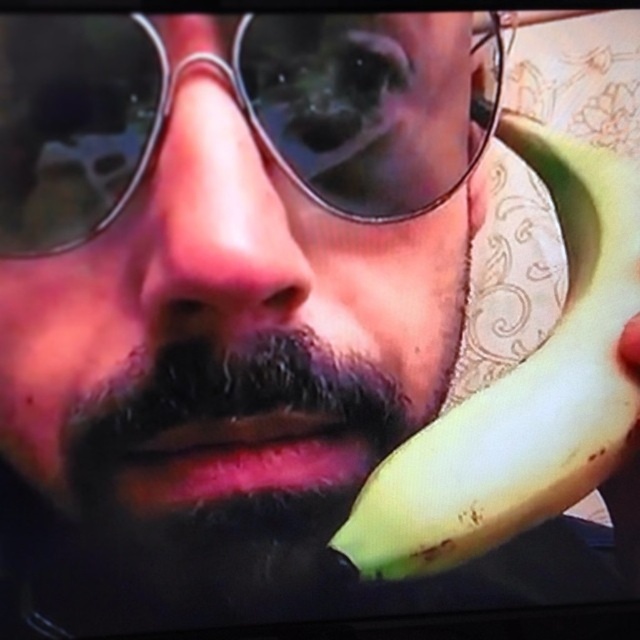
Question: Is matte black sunglasses at center closer to camera compared to metallic round sunglasses at center?

Choices:
 (A) yes
 (B) no

Answer: (B)

Question: Which point is farther from the camera taking this photo?

Choices:
 (A) (630, 435)
 (B) (241, 150)

Answer: (A)

Question: Can you confirm if matte black sunglasses at center is positioned to the right of metallic round sunglasses at center?

Choices:
 (A) yes
 (B) no

Answer: (B)

Question: Which point is farther to the camera?

Choices:
 (A) (51, 88)
 (B) (76, 189)
 (C) (595, 326)

Answer: (C)

Question: Observing the image, what is the correct spatial positioning of matte black sunglasses at center in reference to metallic round sunglasses at center?

Choices:
 (A) right
 (B) left

Answer: (B)

Question: Which object is the closest to the matte black sunglasses at center?

Choices:
 (A) metallic round sunglasses at center
 (B) yellow matte banana at right

Answer: (A)